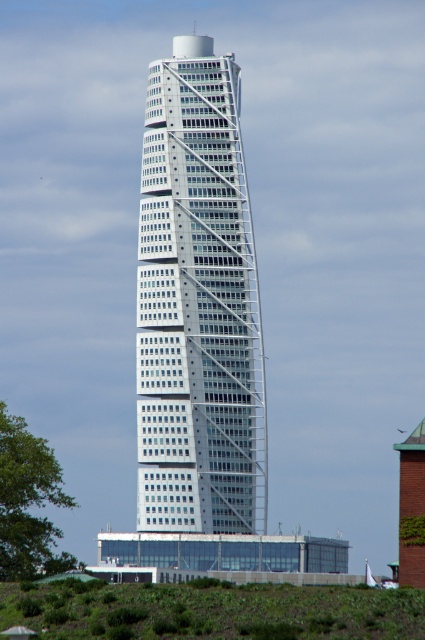
You are a drone operator who needs to fly a drone from the green grass at lower left to the white glass building at center. Considering the height difference between them, will the drone need to ascend significantly to reach the building?

The white glass building at center is much taller than the green grass at lower left, so the drone will need to ascend significantly to reach the building.

You are standing at the origin point of a coordinate system placed at the bottom left corner of the image. You want to locate the white glass building at center. What are its coordinates?

The white glass building at center is located at coordinates point (198, 305).